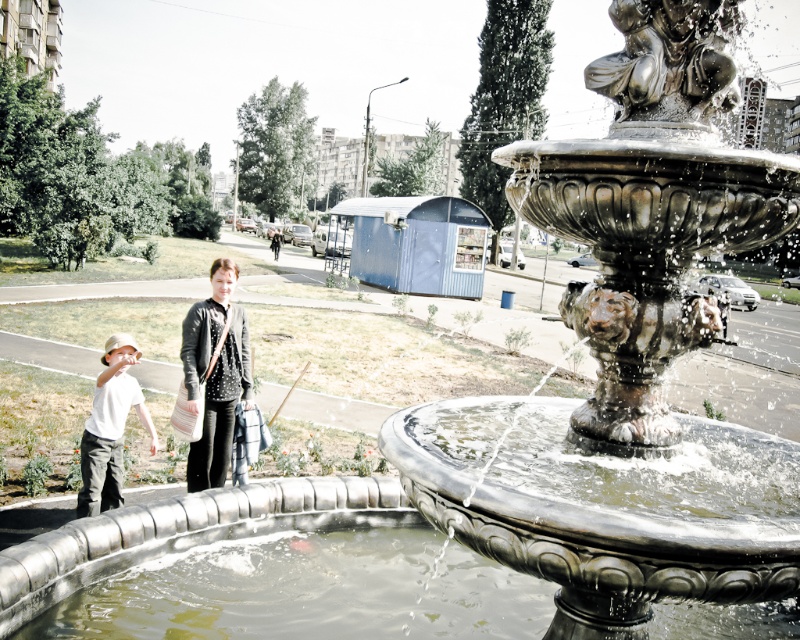
Measure the distance between clear water at fountain center and white matte shirt at lower left.

The distance of clear water at fountain center from white matte shirt at lower left is 1.52 meters.

Is clear water at fountain center smaller than white matte shirt at lower left?

Actually, clear water at fountain center might be larger than white matte shirt at lower left.

Is point (462, 596) closer to camera compared to point (138, 396)?

That is True.

Locate an element on the screen. Image resolution: width=800 pixels, height=640 pixels. clear water at fountain center is located at coordinates (308, 592).

Between bronze statue at center and white matte shirt at lower left, which one is positioned higher?

bronze statue at center

Who is more distant from viewer, (644, 3) or (122, 465)?

Positioned behind is point (122, 465).

At what (x,y) coordinates should I click in order to perform the action: click on bronze statue at center. Please return your answer as a coordinate pair (x, y). Image resolution: width=800 pixels, height=640 pixels. Looking at the image, I should click on (668, 60).

The height and width of the screenshot is (640, 800). I want to click on bronze statue at center, so click(668, 60).

Can you confirm if white matte shirt at lower left is shorter than dark gray jacket at center?

Yes, white matte shirt at lower left is shorter than dark gray jacket at center.

Describe the element at coordinates (110, 428) in the screenshot. I see `white matte shirt at lower left` at that location.

Does point (121, 406) lie behind point (278, 228)?

That is False.

At what (x,y) coordinates should I click in order to perform the action: click on white matte shirt at lower left. Please return your answer as a coordinate pair (x, y). The width and height of the screenshot is (800, 640). Looking at the image, I should click on (110, 428).